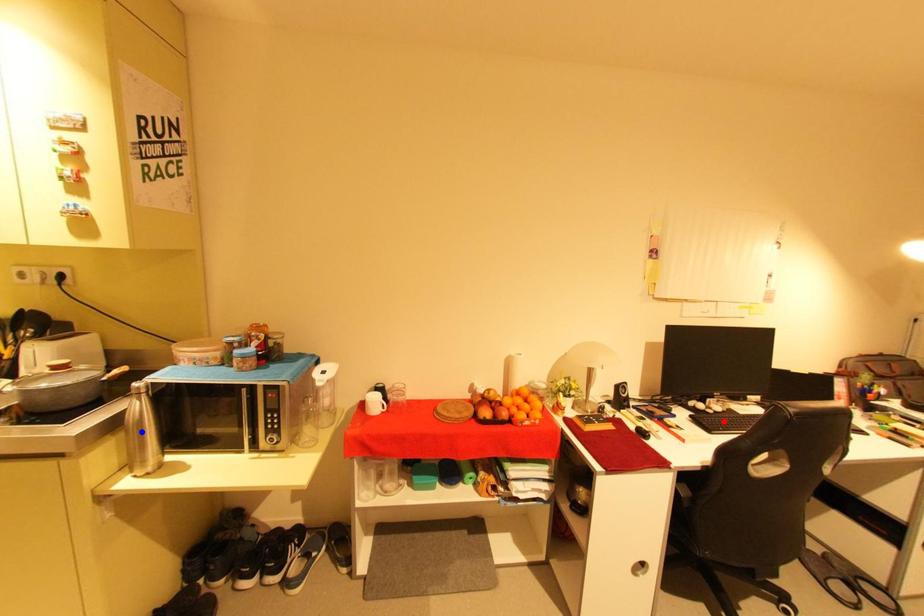
Question: Which of the two points in the image is closer to the camera?

Choices:
 (A) Blue point is closer.
 (B) Red point is closer.

Answer: (A)